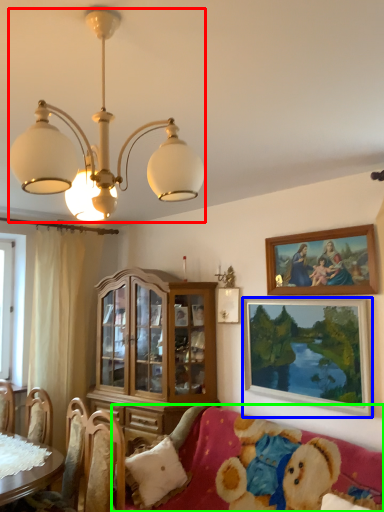
Question: Estimate the real-world distances between objects in this image. Which object is farther from lamp (highlighted by a red box), picture frame (highlighted by a blue box) or studio couch (highlighted by a green box)?

Choices:
 (A) picture frame
 (B) studio couch

Answer: (B)